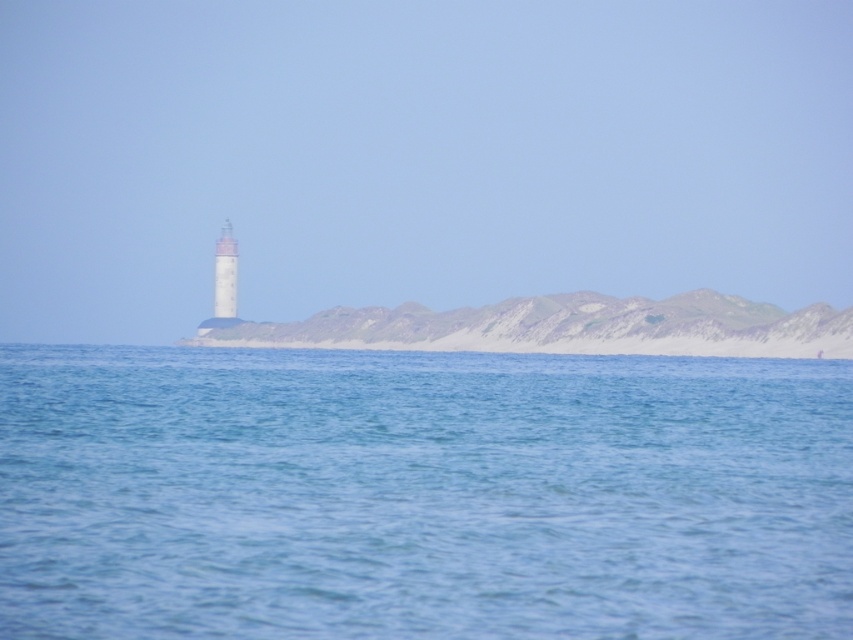
Between rugged sand dunes at center and white textured lighthouse at center, which one is positioned lower?

rugged sand dunes at center is lower down.

How far apart are rugged sand dunes at center and white textured lighthouse at center?

rugged sand dunes at center and white textured lighthouse at center are 91.90 feet apart from each other.

Is point (778, 324) less distant than point (225, 225)?

Yes, point (778, 324) is in front of point (225, 225).

You are a GUI agent. You are given a task and a screenshot of the screen. Output one action in this format:
    pyautogui.click(x=<x>, y=<y>)
    Task: Click on the rugged sand dunes at center
    
    Given the screenshot: What is the action you would take?
    pyautogui.click(x=567, y=326)

Between point (157, 484) and point (219, 314), which one is positioned in front?

Point (157, 484)

Between point (195, 579) and point (228, 250), which one is positioned behind?

The point (228, 250) is more distant.

Is point (616, 563) positioned before point (216, 262)?

Yes, it is in front of point (216, 262).

Image resolution: width=853 pixels, height=640 pixels. I want to click on blue water at center, so click(x=421, y=493).

This screenshot has height=640, width=853. What do you see at coordinates (421, 493) in the screenshot?
I see `blue water at center` at bounding box center [421, 493].

Does point (422, 353) come in front of point (523, 333)?

Yes, it is.

The height and width of the screenshot is (640, 853). I want to click on blue water at center, so click(x=421, y=493).